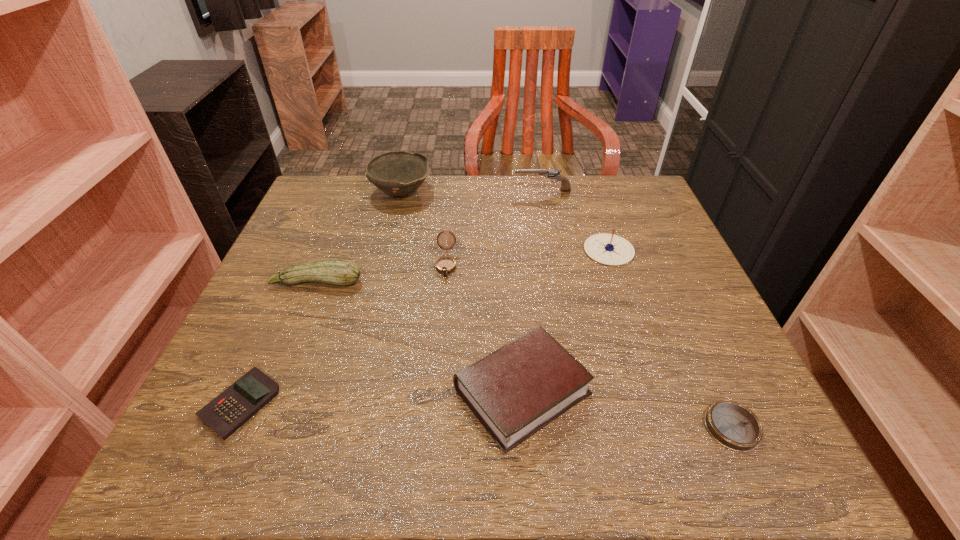
What are the coordinates of `the tallest object` in the screenshot? It's located at (397, 173).

The width and height of the screenshot is (960, 540). In order to click on gun in this screenshot , I will do `click(552, 174)`.

Where is `the second compass from left to right`? This screenshot has width=960, height=540. the second compass from left to right is located at coordinates 609,249.

Where is `the leftmost compass`? The image size is (960, 540). the leftmost compass is located at coordinates (445, 265).

Image resolution: width=960 pixels, height=540 pixels. What are the coordinates of `zucchini` in the screenshot? It's located at (343, 272).

Locate an element on the screen. The height and width of the screenshot is (540, 960). Bible is located at coordinates (515, 391).

You are a GUI agent. You are given a task and a screenshot of the screen. Output one action in this format:
    pyautogui.click(x=<x>, y=<y>)
    Task: Click on the calculator
    The height and width of the screenshot is (540, 960).
    Given the screenshot: What is the action you would take?
    pyautogui.click(x=226, y=413)

The width and height of the screenshot is (960, 540). I want to click on the rightmost object, so click(733, 425).

Where is `the rightmost compass`? The width and height of the screenshot is (960, 540). the rightmost compass is located at coordinates (733, 425).

Where is `vacant space located 0.220m on the front of the bowl`? The width and height of the screenshot is (960, 540). vacant space located 0.220m on the front of the bowl is located at coordinates (382, 266).